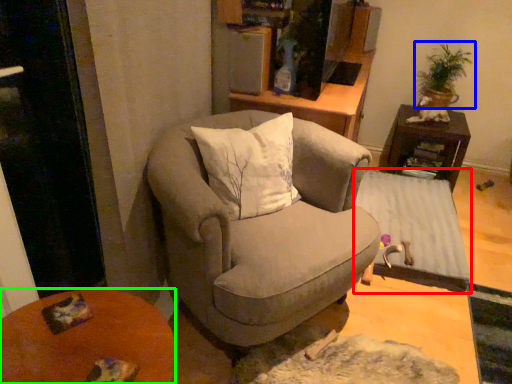
Question: Based on their relative distances, which object is nearer to table (highlighted by a red box)? Choose from houseplant (highlighted by a blue box) and desk (highlighted by a green box).

Choices:
 (A) houseplant
 (B) desk

Answer: (A)